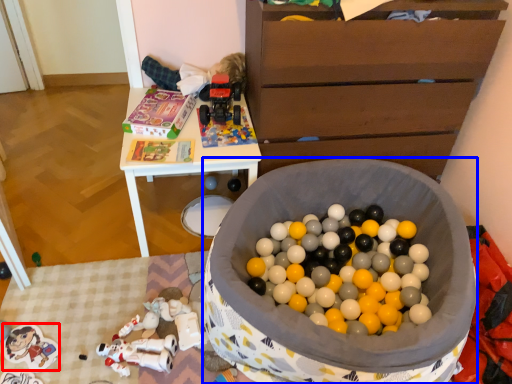
Question: Which object is closer to the camera taking this photo, toy (highlighted by a red box) or toy (highlighted by a blue box)?

Choices:
 (A) toy
 (B) toy

Answer: (B)